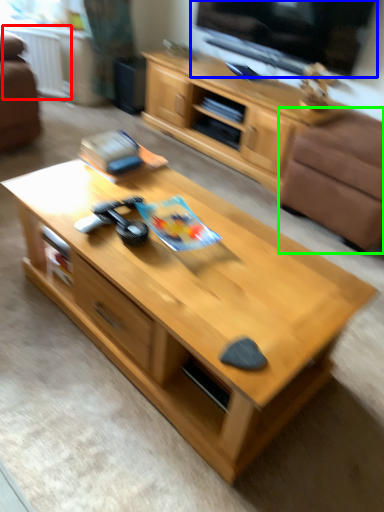
Question: Based on their relative distances, which object is farther from radiator (highlighted by a red box)? Choose from window screen (highlighted by a blue box) and armchair (highlighted by a green box).

Choices:
 (A) window screen
 (B) armchair

Answer: (B)